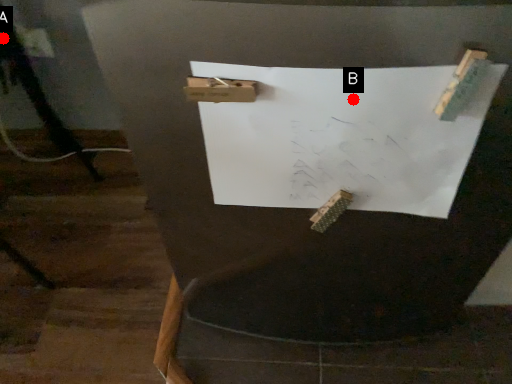
Question: Two points are circled on the image, labeled by A and B beside each circle. Which of the following is the farthest from the observer?

Choices:
 (A) A is further
 (B) B is further

Answer: (A)